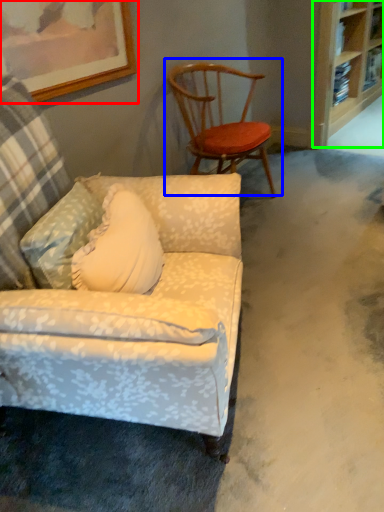
Question: Which object is positioned closest to picture frame (highlighted by a red box)? Select from chair (highlighted by a blue box) and shelf (highlighted by a green box).

Choices:
 (A) chair
 (B) shelf

Answer: (A)